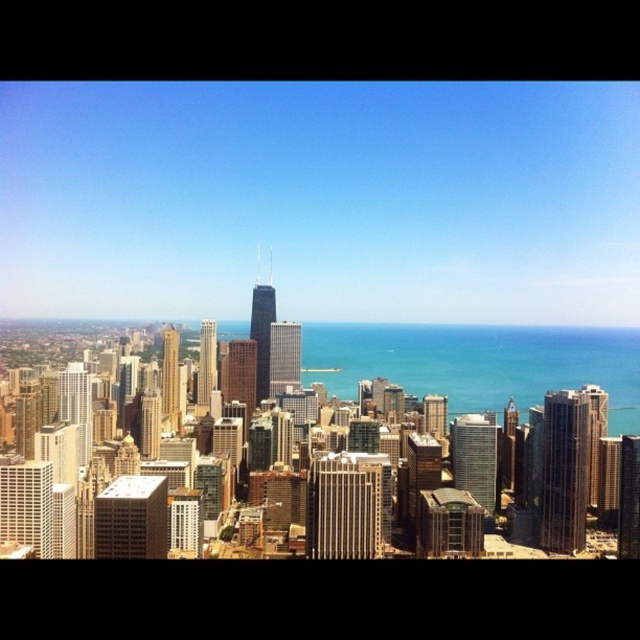
You are a city planner analyzing the Chicago skyline. You observe the glassy reflective skyscraper at center and the gold reflective skyscraper at center. Which one appears higher in the image?

The glassy reflective skyscraper at center appears higher because it is positioned above the gold reflective skyscraper at center in the image.